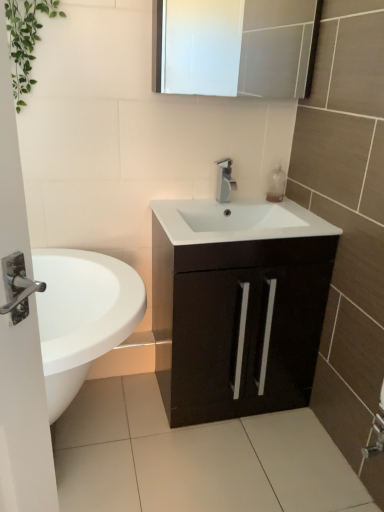
Find the location of a particular element. The width and height of the screenshot is (384, 512). vacant area to the right of silver metallic faucet at center is located at coordinates (269, 205).